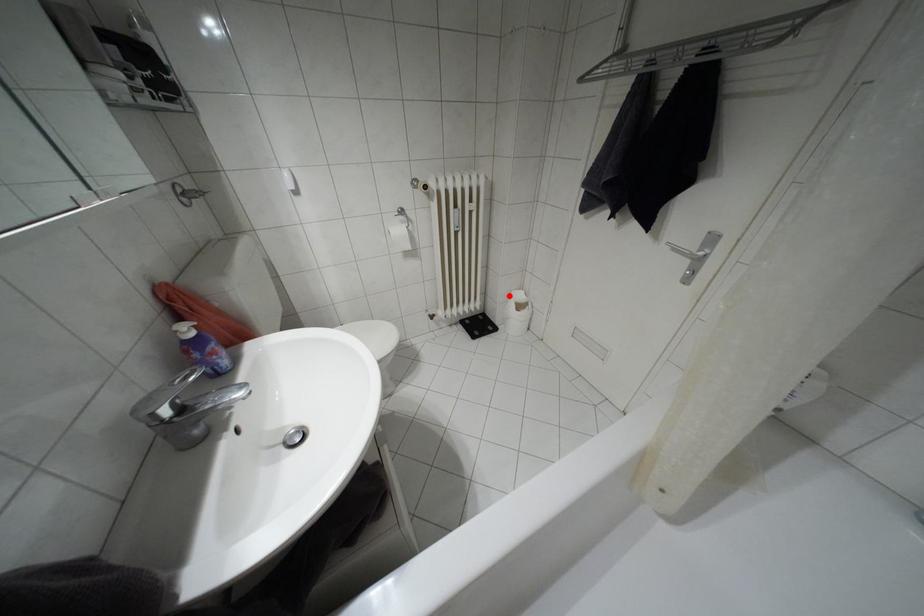
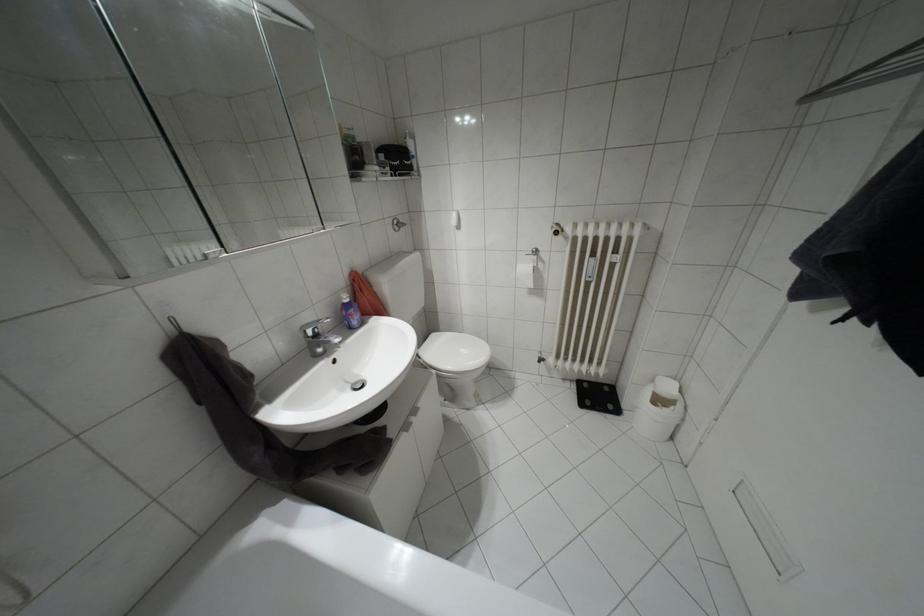
Question: I am providing you with two images of the same scene from different viewpoints. Given a red point in image1, look at the same physical point in image2. Is it:

Choices:
 (A) Closer to the viewpoint
 (B) Farther from the viewpoint

Answer: (A)